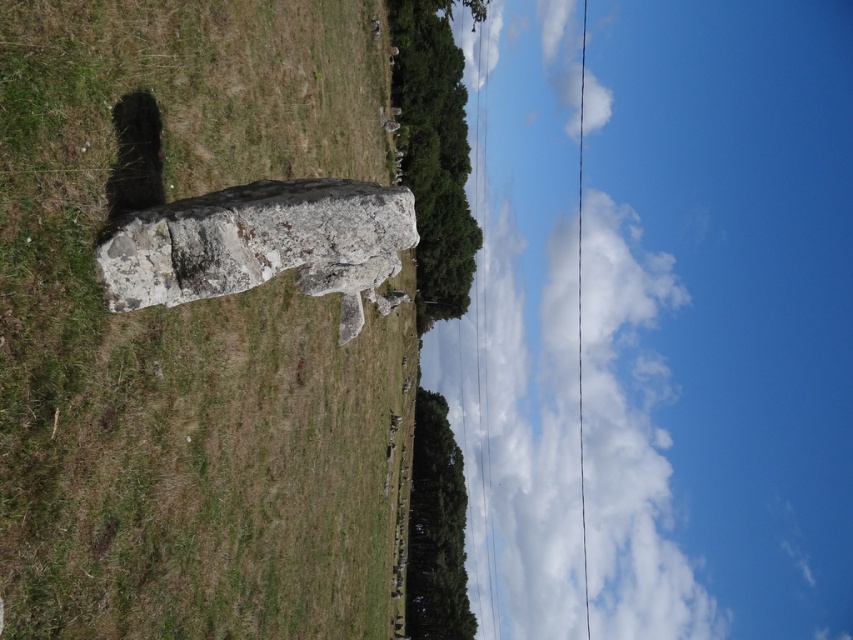
Question: Is speckled stone monolith at center above white fluffy cloud at upper center?

Choices:
 (A) yes
 (B) no

Answer: (A)

Question: Which point is closer to the camera?

Choices:
 (A) (599, 577)
 (B) (123, 241)

Answer: (B)

Question: Among these points, which one is nearest to the camera?

Choices:
 (A) (73, 436)
 (B) (490, 349)
 (C) (206, 221)

Answer: (A)

Question: Does speckled stone monolith at center have a larger size compared to rough stone rock at center?

Choices:
 (A) no
 (B) yes

Answer: (B)

Question: Among these points, which one is nearest to the camera?

Choices:
 (A) (241, 260)
 (B) (309, 76)
 (C) (573, 3)

Answer: (A)

Question: Is speckled stone monolith at center closer to camera compared to rough stone rock at center?

Choices:
 (A) no
 (B) yes

Answer: (B)